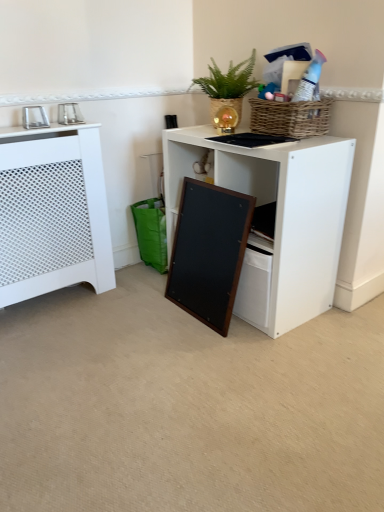
You are a GUI agent. You are given a task and a screenshot of the screen. Output one action in this format:
    pyautogui.click(x=<x>, y=<y>)
    Task: Click on the vacant space that is to the left of white matte desk at center
    The height and width of the screenshot is (512, 384).
    Given the screenshot: What is the action you would take?
    coord(125,315)